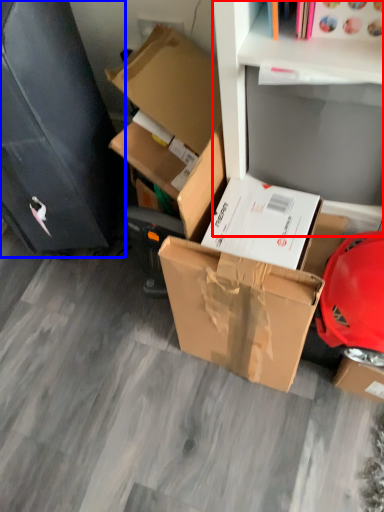
Question: Among these objects, which one is farthest to the camera, shelf (highlighted by a red box) or file cabinet (highlighted by a blue box)?

Choices:
 (A) shelf
 (B) file cabinet

Answer: (B)